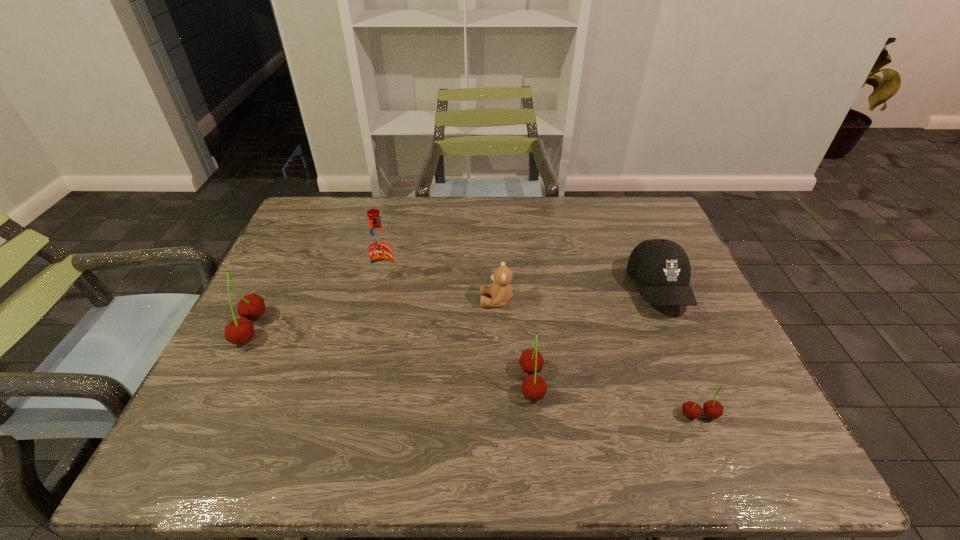
Locate an element on the screen. vacant region located 0.280m on the surface of the second cherry from right to left is located at coordinates pyautogui.click(x=673, y=383).

Where is `vacant region located on the front-facing side of the baseball cap`? vacant region located on the front-facing side of the baseball cap is located at coordinates (686, 352).

Image resolution: width=960 pixels, height=540 pixels. In order to click on free region located on the back of the root beer in this screenshot , I will do `click(392, 255)`.

The width and height of the screenshot is (960, 540). Identify the location of free region located 0.350m on the front-facing side of the teddy bear. (347, 301).

At what (x,y) coordinates should I click in order to perform the action: click on free region located 0.240m on the front-facing side of the teddy bear. Please return your answer as a coordinate pair (x, y). Image resolution: width=960 pixels, height=540 pixels. Looking at the image, I should click on (389, 301).

Where is `vacant space located 0.350m on the front-facing side of the teddy bear`? vacant space located 0.350m on the front-facing side of the teddy bear is located at coordinates (347, 301).

Locate an element on the screen. The height and width of the screenshot is (540, 960). object at the left edge is located at coordinates (239, 331).

This screenshot has width=960, height=540. What are the coordinates of `cherry located at the right edge` in the screenshot? It's located at (713, 409).

Identify the location of baseball cap that is at the right edge. (661, 269).

I want to click on object at the near right corner, so click(713, 409).